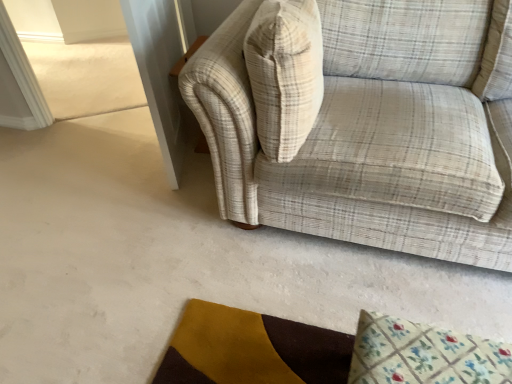
Where is `vacant space behind floral fabric mat at lower right`? vacant space behind floral fabric mat at lower right is located at coordinates (391, 295).